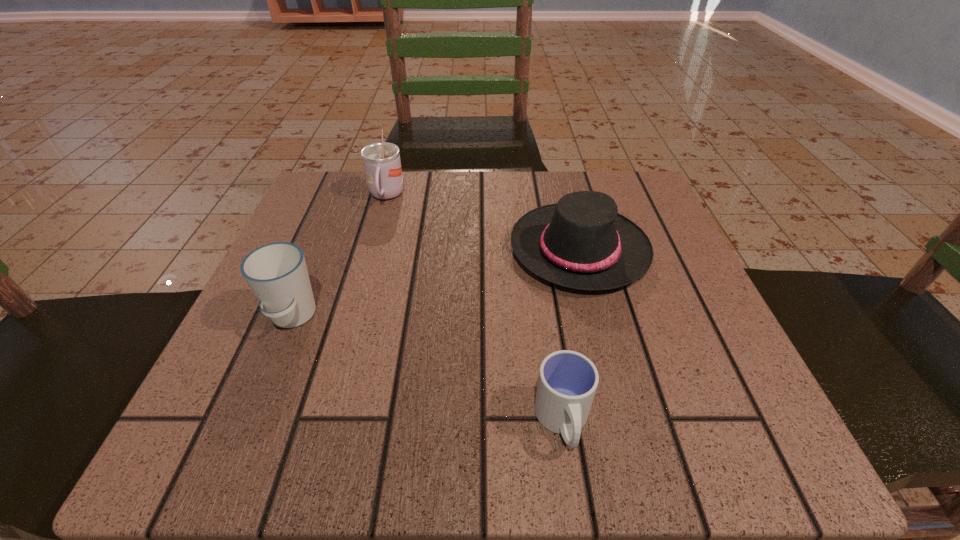
Find the location of a particular element. The image size is (960, 540). the farthest cup is located at coordinates (382, 165).

At what (x,y) coordinates should I click in order to perform the action: click on the third object from right to left. Please return your answer as a coordinate pair (x, y). The height and width of the screenshot is (540, 960). Looking at the image, I should click on (382, 165).

Locate an element on the screen. the leftmost object is located at coordinates (277, 274).

Locate an element on the screen. The image size is (960, 540). the leftmost cup is located at coordinates (277, 274).

I want to click on dress hat, so click(581, 242).

What are the coordinates of `the nearest object` in the screenshot? It's located at (567, 382).

The height and width of the screenshot is (540, 960). In order to click on the shortest cup in this screenshot , I will do `click(567, 382)`.

The height and width of the screenshot is (540, 960). Find the location of `vacant position located on the side with the handle of the second object from left to right`. vacant position located on the side with the handle of the second object from left to right is located at coordinates (359, 290).

The width and height of the screenshot is (960, 540). I want to click on vacant area located with a handle on the side of the second nearest cup, so click(244, 435).

Identify the location of blank area located on the front of the dress hat. This screenshot has height=540, width=960. (618, 400).